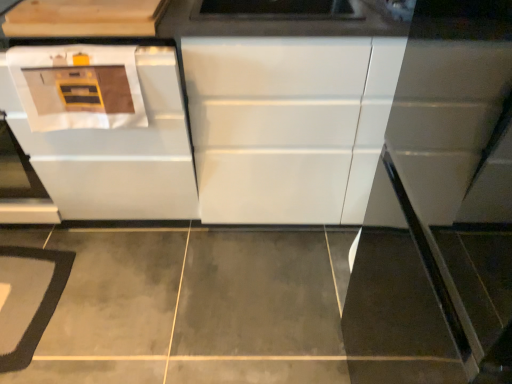
At what (x,y) coordinates should I click in order to perform the action: click on white glossy cabinet at center, which is counted as the 2th cabinetry, starting from the left. Please return your answer as a coordinate pair (x, y). Image resolution: width=512 pixels, height=384 pixels. Looking at the image, I should click on (253, 104).

What are the coordinates of `gray carpet at lower left` in the screenshot? It's located at (39, 305).

Identify the location of white glossy oven at left. tap(103, 129).

The width and height of the screenshot is (512, 384). What are the coordinates of `white glossy cabinet at center, which is counted as the 2th cabinetry, starting from the left` in the screenshot? It's located at (253, 104).

Is white glossy cabinet at center, the first cabinetry positioned from the right, positioned behind white glossy oven at left?

Yes, white glossy cabinet at center, the first cabinetry positioned from the right, is further from the viewer.

Which point is more distant from viewer, (272, 41) or (85, 204)?

The point (85, 204) is behind.

From a real-world perspective, is white glossy cabinet at center, the first cabinetry positioned from the right, positioned under white glossy oven at left based on gravity?

No.

Considering the sizes of objects white glossy cabinet at center, which is counted as the 2th cabinetry, starting from the left, and white glossy oven at left in the image provided, who is wider, white glossy cabinet at center, which is counted as the 2th cabinetry, starting from the left, or white glossy oven at left?

white glossy oven at left.

Which is behind, point (129, 5) or point (68, 258)?

Positioned behind is point (68, 258).

Is light wood cabinet at upper left, arranged as the 2th cabinetry when viewed from the right, facing away from gray carpet at lower left?

No, light wood cabinet at upper left, arranged as the 2th cabinetry when viewed from the right,'s orientation is not away from gray carpet at lower left.

Is light wood cabinet at upper left, arranged as the 2th cabinetry when viewed from the right, situated inside gray carpet at lower left or outside?

light wood cabinet at upper left, arranged as the 2th cabinetry when viewed from the right, is spatially situated outside gray carpet at lower left.

Is light wood cabinet at upper left, arranged as the 2th cabinetry when viewed from the right, bigger than gray carpet at lower left?

Indeed, light wood cabinet at upper left, arranged as the 2th cabinetry when viewed from the right, has a larger size compared to gray carpet at lower left.

Could you tell me if white glossy oven at left is facing gray carpet at lower left?

No, white glossy oven at left is not facing towards gray carpet at lower left.

Find the location of a particular element. oven located above the gray carpet at lower left (from a real-world perspective) is located at coordinates (103, 129).

Between white glossy oven at left and gray carpet at lower left, which one has smaller width?

Thinner between the two is gray carpet at lower left.

Considering the relative sizes of white glossy oven at left and gray carpet at lower left in the image provided, is white glossy oven at left bigger than gray carpet at lower left?

Yes, white glossy oven at left is bigger than gray carpet at lower left.

Does white glossy cabinet at center, which is counted as the 2th cabinetry, starting from the left, have a smaller size compared to light wood cabinet at upper left, the first cabinetry from the left?

Incorrect, white glossy cabinet at center, which is counted as the 2th cabinetry, starting from the left, is not smaller in size than light wood cabinet at upper left, the first cabinetry from the left.

From the image's perspective, is white glossy cabinet at center, which is counted as the 2th cabinetry, starting from the left, located above or below light wood cabinet at upper left, the first cabinetry from the left?

white glossy cabinet at center, which is counted as the 2th cabinetry, starting from the left, is situated lower than light wood cabinet at upper left, the first cabinetry from the left, in the image.

Considering the sizes of objects white glossy cabinet at center, which is counted as the 2th cabinetry, starting from the left, and light wood cabinet at upper left, arranged as the 2th cabinetry when viewed from the right, in the image provided, who is taller, white glossy cabinet at center, which is counted as the 2th cabinetry, starting from the left, or light wood cabinet at upper left, arranged as the 2th cabinetry when viewed from the right,?

white glossy cabinet at center, which is counted as the 2th cabinetry, starting from the left.

Consider the image. Does white glossy cabinet at center, the first cabinetry positioned from the right, contain light wood cabinet at upper left, arranged as the 2th cabinetry when viewed from the right?

Yes, light wood cabinet at upper left, arranged as the 2th cabinetry when viewed from the right, is surrounded by white glossy cabinet at center, the first cabinetry positioned from the right.

Can you confirm if white glossy cabinet at center, the first cabinetry positioned from the right, is wider than gray carpet at lower left?

Correct, the width of white glossy cabinet at center, the first cabinetry positioned from the right, exceeds that of gray carpet at lower left.

Considering the positions of point (331, 91) and point (33, 257), is point (331, 91) closer or farther from the camera than point (33, 257)?

Point (331, 91) is closer to the camera than point (33, 257).

From a real-world perspective, is white glossy cabinet at center, the first cabinetry positioned from the right, physically above gray carpet at lower left?

Yes, from a real-world perspective, white glossy cabinet at center, the first cabinetry positioned from the right, is above gray carpet at lower left.

Which object is further away from the camera taking this photo, white glossy cabinet at center, which is counted as the 2th cabinetry, starting from the left, or gray carpet at lower left?

gray carpet at lower left is behind.

Considering the sizes of white glossy oven at left and light wood cabinet at upper left, the first cabinetry from the left, in the image, is white glossy oven at left bigger or smaller than light wood cabinet at upper left, the first cabinetry from the left,?

Clearly, white glossy oven at left is larger in size than light wood cabinet at upper left, the first cabinetry from the left.

Could you tell me if white glossy oven at left is turned towards light wood cabinet at upper left, arranged as the 2th cabinetry when viewed from the right?

No, white glossy oven at left is not turned towards light wood cabinet at upper left, arranged as the 2th cabinetry when viewed from the right.

Between white glossy oven at left and light wood cabinet at upper left, arranged as the 2th cabinetry when viewed from the right, which one appears on the right side from the viewer's perspective?

white glossy oven at left is more to the right.

From the image's perspective, would you say white glossy oven at left is shown under light wood cabinet at upper left, arranged as the 2th cabinetry when viewed from the right?

Correct, white glossy oven at left appears lower than light wood cabinet at upper left, arranged as the 2th cabinetry when viewed from the right, in the image.

From the picture: Which object is more forward, light wood cabinet at upper left, the first cabinetry from the left, or white glossy cabinet at center, which is counted as the 2th cabinetry, starting from the left?

light wood cabinet at upper left, the first cabinetry from the left, is in front.

Is light wood cabinet at upper left, arranged as the 2th cabinetry when viewed from the right, to the left of white glossy cabinet at center, the first cabinetry positioned from the right, from the viewer's perspective?

Correct, you'll find light wood cabinet at upper left, arranged as the 2th cabinetry when viewed from the right, to the left of white glossy cabinet at center, the first cabinetry positioned from the right.

In terms of height, does light wood cabinet at upper left, the first cabinetry from the left, look taller or shorter compared to white glossy cabinet at center, the first cabinetry positioned from the right?

Clearly, light wood cabinet at upper left, the first cabinetry from the left, is shorter compared to white glossy cabinet at center, the first cabinetry positioned from the right.

Where is `cabinetry on the right of white glossy oven at left`? Image resolution: width=512 pixels, height=384 pixels. cabinetry on the right of white glossy oven at left is located at coordinates (253, 104).

At what (x,y) coordinates should I click in order to perform the action: click on mat that appears below the light wood cabinet at upper left, arranged as the 2th cabinetry when viewed from the right (from a real-world perspective). Please return your answer as a coordinate pair (x, y). The height and width of the screenshot is (384, 512). Looking at the image, I should click on (39, 305).

Based on their spatial positions, is white glossy cabinet at center, which is counted as the 2th cabinetry, starting from the left, or gray carpet at lower left further from light wood cabinet at upper left, arranged as the 2th cabinetry when viewed from the right?

gray carpet at lower left lies further to light wood cabinet at upper left, arranged as the 2th cabinetry when viewed from the right, than the other object.

When comparing their distances from gray carpet at lower left, does white glossy cabinet at center, the first cabinetry positioned from the right, or white glossy oven at left seem further?

Based on the image, white glossy cabinet at center, the first cabinetry positioned from the right, appears to be further to gray carpet at lower left.

Based on the photo, considering their positions, is white glossy oven at left positioned further to gray carpet at lower left than light wood cabinet at upper left, the first cabinetry from the left?

light wood cabinet at upper left, the first cabinetry from the left, lies further to gray carpet at lower left than the other object.

Considering their positions, is gray carpet at lower left positioned further to white glossy oven at left than white glossy cabinet at center, the first cabinetry positioned from the right?

Based on the image, gray carpet at lower left appears to be further to white glossy oven at left.

Looking at the image, which one is located closer to light wood cabinet at upper left, arranged as the 2th cabinetry when viewed from the right, gray carpet at lower left or white glossy oven at left?

white glossy oven at left is positioned closer to the anchor light wood cabinet at upper left, arranged as the 2th cabinetry when viewed from the right.

When comparing their distances from white glossy cabinet at center, which is counted as the 2th cabinetry, starting from the left, does white glossy oven at left or light wood cabinet at upper left, the first cabinetry from the left, seem further?

Among the two, light wood cabinet at upper left, the first cabinetry from the left, is located further to white glossy cabinet at center, which is counted as the 2th cabinetry, starting from the left.

From the image, which object appears to be farther from gray carpet at lower left, white glossy oven at left or white glossy cabinet at center, the first cabinetry positioned from the right?

white glossy cabinet at center, the first cabinetry positioned from the right, lies further to gray carpet at lower left than the other object.

When comparing their distances from white glossy oven at left, does light wood cabinet at upper left, the first cabinetry from the left, or white glossy cabinet at center, the first cabinetry positioned from the right, seem closer?

Based on the image, white glossy cabinet at center, the first cabinetry positioned from the right, appears to be nearer to white glossy oven at left.

Locate an element on the screen. The width and height of the screenshot is (512, 384). oven between light wood cabinet at upper left, arranged as the 2th cabinetry when viewed from the right, and gray carpet at lower left in the up-down direction is located at coordinates (103, 129).

You are a GUI agent. You are given a task and a screenshot of the screen. Output one action in this format:
    pyautogui.click(x=<x>, y=<y>)
    Task: Click on the oven located between light wood cabinet at upper left, arranged as the 2th cabinetry when viewed from the right, and white glossy cabinet at center, which is counted as the 2th cabinetry, starting from the left, in the left-right direction
    Image resolution: width=512 pixels, height=384 pixels.
    Given the screenshot: What is the action you would take?
    pyautogui.click(x=103, y=129)

Image resolution: width=512 pixels, height=384 pixels. In order to click on cabinetry between light wood cabinet at upper left, the first cabinetry from the left, and gray carpet at lower left vertically in this screenshot , I will do `click(253, 104)`.

This screenshot has height=384, width=512. Identify the location of oven between white glossy cabinet at center, the first cabinetry positioned from the right, and gray carpet at lower left vertically. (103, 129).